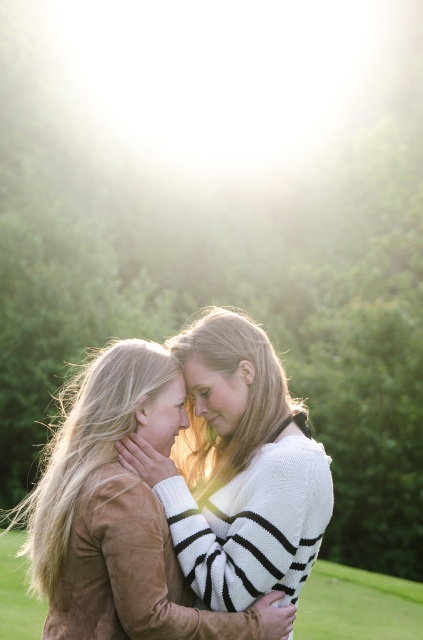
Can you confirm if suede brown jacket at center is positioned above suede jacket at center?

Actually, suede brown jacket at center is below suede jacket at center.

Is point (99, 637) positioned after point (123, 560)?

That is True.

You are a GUI agent. You are given a task and a screenshot of the screen. Output one action in this format:
    pyautogui.click(x=<x>, y=<y>)
    Task: Click on the suede brown jacket at center
    The height and width of the screenshot is (640, 423).
    Given the screenshot: What is the action you would take?
    pyautogui.click(x=120, y=516)

Which is behind, point (120, 483) or point (403, 602)?

Positioned behind is point (403, 602).

Can you confirm if suede brown jacket at center is shorter than green grass at lower right?

Yes, suede brown jacket at center is shorter than green grass at lower right.

Is point (137, 536) closer to viewer compared to point (373, 618)?

Yes.

In order to click on suede brown jacket at center in this screenshot , I will do `click(120, 516)`.

Is suede jacket at center to the left of green grass at lower right from the viewer's perspective?

Indeed, suede jacket at center is positioned on the left side of green grass at lower right.

Between suede jacket at center and green grass at lower right, which one has more height?

With more height is green grass at lower right.

Who is more distant from viewer, (115, 600) or (304, 605)?

Point (304, 605)

This screenshot has width=423, height=640. I want to click on suede jacket at center, so click(129, 572).